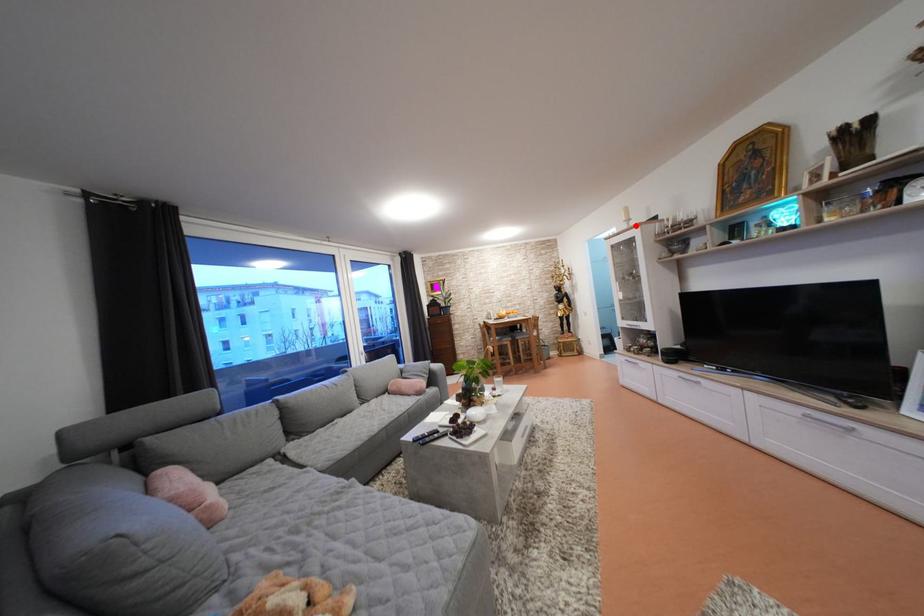
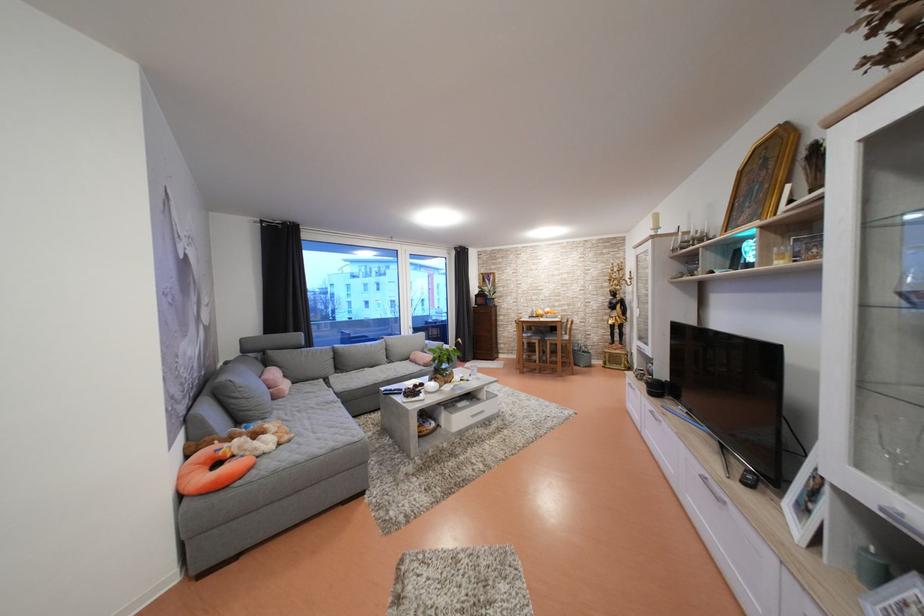
Find the pixel in the second image that matches the highlighted location in the first image.

(664, 233)